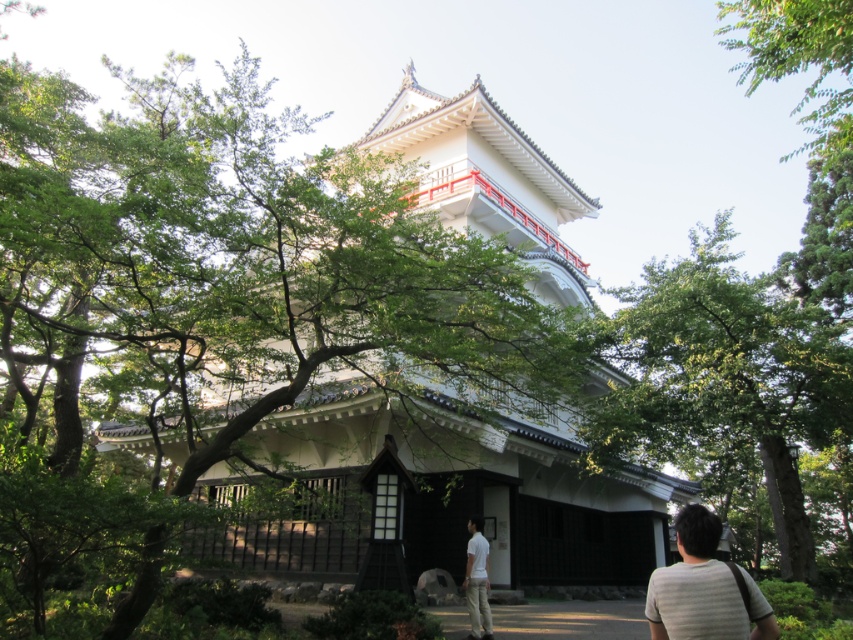
You are a tourist visiting the traditional Japanese building and notice the white wooden pagoda at center and the striped cotton shirt at lower right. Which object appears larger in the image?

The white wooden pagoda at center appears larger than the striped cotton shirt at lower right because it is much taller.

You are a visitor walking along the brown dirt path at lower center near the traditional Japanese building. You want to take a photo of the green leafy tree at center. Which direction should you face to capture the tree in your camera?

You should face upward to capture the green leafy tree at center since it is located above the brown dirt path at lower center where you are standing.